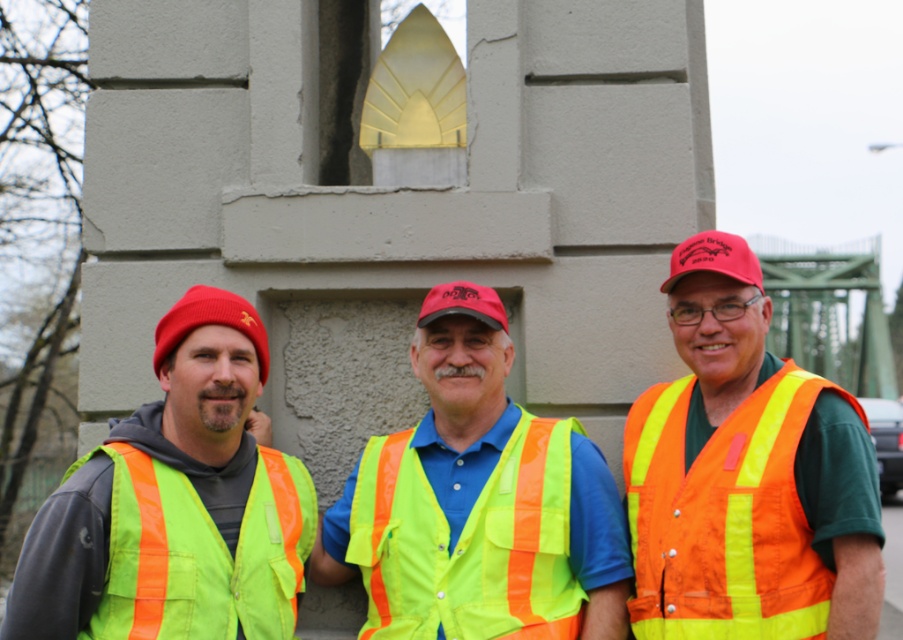
Between neon green reflective safety vest at left and red fabric cap at center, which one is positioned lower?

neon green reflective safety vest at left

Can you confirm if neon green reflective safety vest at left is positioned above red fabric cap at center?

No, neon green reflective safety vest at left is not above red fabric cap at center.

At what (x,y) coordinates should I click in order to perform the action: click on neon green reflective safety vest at left. Please return your answer as a coordinate pair (x, y). The height and width of the screenshot is (640, 903). Looking at the image, I should click on (201, 552).

Does orange reflective safety vest at right lie behind matte black cap at center?

No, it is in front of matte black cap at center.

Which is in front, point (659, 593) or point (425, 310)?

Point (659, 593) is in front.

Locate an element on the screen. The width and height of the screenshot is (903, 640). orange reflective safety vest at right is located at coordinates (725, 515).

Is matte green safety vest at center smaller than neon green reflective safety vest at left?

Actually, matte green safety vest at center might be larger than neon green reflective safety vest at left.

Does matte green safety vest at center come behind neon green reflective safety vest at left?

No, it is in front of neon green reflective safety vest at left.

Identify the location of matte green safety vest at center. (191, 486).

This screenshot has width=903, height=640. Identify the location of matte green safety vest at center. (191, 486).